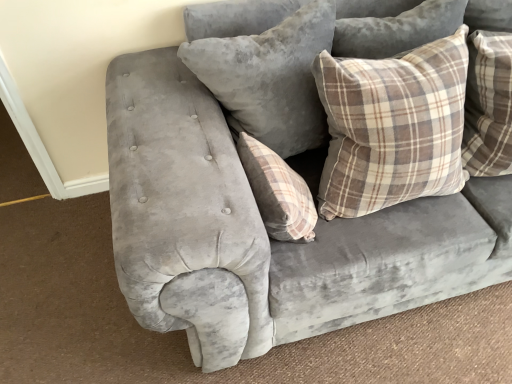
Question: Would you say plush gray pillow at upper center, the first pillow when ordered from left to right, is inside or outside brown plaid pillow at upper right, which is the third pillow in left-to-right order?

Choices:
 (A) inside
 (B) outside

Answer: (B)

Question: Is plush gray pillow at upper center, the first pillow when ordered from left to right, taller or shorter than brown plaid pillow at upper right, which is the third pillow in left-to-right order?

Choices:
 (A) tall
 (B) short

Answer: (A)

Question: Which object is the farthest from the brown plaid pillow at upper right, which is the third pillow in left-to-right order?

Choices:
 (A) plaid fabric pillow at center, the second pillow positioned from the left
 (B) plush gray pillow at upper center, which appears as the 3th pillow when viewed from the right

Answer: (A)

Question: Estimate the real-world distances between objects in this image. Which object is farther from the plaid fabric pillow at center, the second pillow positioned from the left?

Choices:
 (A) plush gray pillow at upper center, which appears as the 3th pillow when viewed from the right
 (B) brown plaid pillow at upper right, which is the third pillow in left-to-right order

Answer: (A)